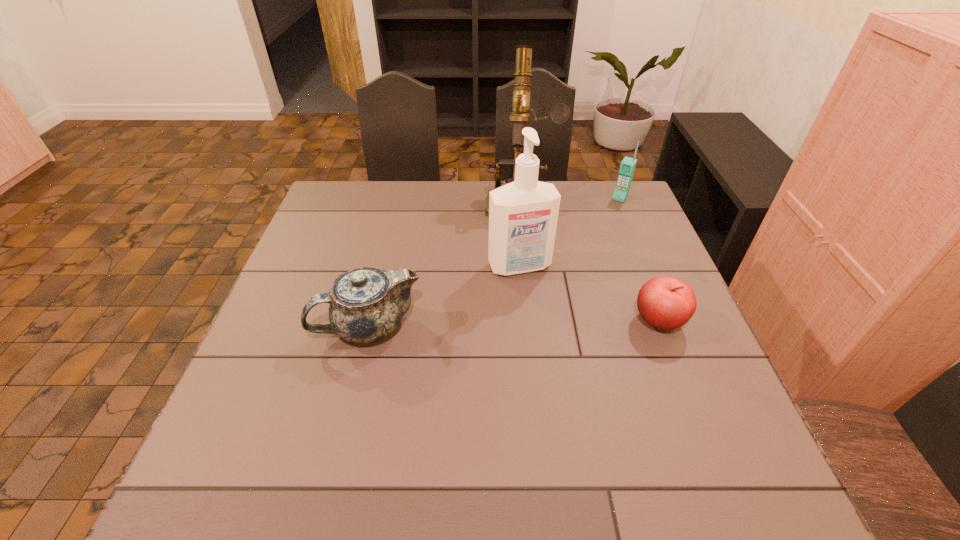
You are a GUI agent. You are given a task and a screenshot of the screen. Output one action in this format:
    pyautogui.click(x=<x>, y=<y>)
    Task: Click on the vacant space that's between the chinaware and the second tallest object
    The height and width of the screenshot is (540, 960).
    Given the screenshot: What is the action you would take?
    click(444, 296)

Locate an element on the screen. The height and width of the screenshot is (540, 960). unoccupied position between the shortest object and the microscope is located at coordinates (589, 260).

In order to click on vacant space that's between the shortest object and the cellular telephone in this screenshot , I will do `click(639, 259)`.

Where is `empty space between the shortest object and the cellular telephone`? The image size is (960, 540). empty space between the shortest object and the cellular telephone is located at coordinates (639, 259).

The height and width of the screenshot is (540, 960). In order to click on unoccupied area between the microscope and the second shortest object in this screenshot , I will do `click(444, 262)`.

Where is `free space between the chinaware and the microscope`? This screenshot has width=960, height=540. free space between the chinaware and the microscope is located at coordinates (444, 262).

Identify the location of object identified as the second closest to the microscope. The height and width of the screenshot is (540, 960). (627, 167).

Locate which object ranks third in proximity to the chinaware. Please provide its 2D coordinates. Your answer should be formatted as a tuple, i.e. [(x, y)], where the tuple contains the x and y coordinates of a point satisfying the conditions above.

[(666, 303)]